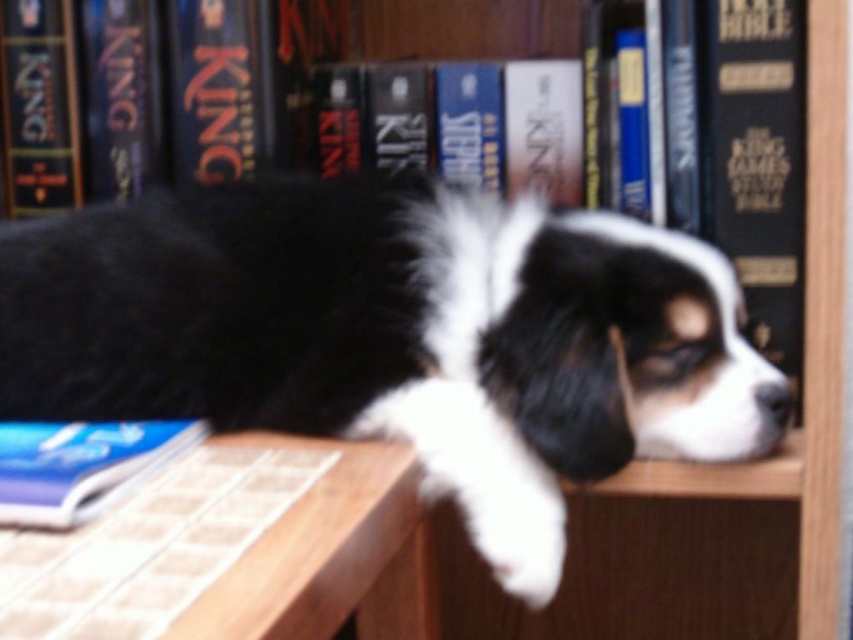
The image size is (853, 640). Describe the element at coordinates (757, 163) in the screenshot. I see `hardcover book at upper right` at that location.

Which is behind, point (793, 17) or point (48, 445)?

The point (793, 17) is behind.

Is point (759, 342) positioned before point (48, 518)?

No, it is behind (48, 518).

Locate an element on the screen. hardcover book at upper right is located at coordinates (757, 163).

Is black and white fur at center below blue paperback book at lower left?

No, black and white fur at center is not below blue paperback book at lower left.

Describe the element at coordinates (396, 337) in the screenshot. I see `black and white fur at center` at that location.

Describe the element at coordinates (396, 337) in the screenshot. Image resolution: width=853 pixels, height=640 pixels. I see `black and white fur at center` at that location.

Where is `black and white fur at center`? The height and width of the screenshot is (640, 853). black and white fur at center is located at coordinates (396, 337).

Does black and white fur at center have a lesser height compared to hardcover book at upper right?

Yes.

Does point (140, 204) come in front of point (758, 104)?

No, it is behind (758, 104).

Where is `black and white fur at center`? The height and width of the screenshot is (640, 853). black and white fur at center is located at coordinates (396, 337).

At what (x,y) coordinates should I click in order to perform the action: click on black and white fur at center. Please return your answer as a coordinate pair (x, y). The height and width of the screenshot is (640, 853). Looking at the image, I should click on (396, 337).